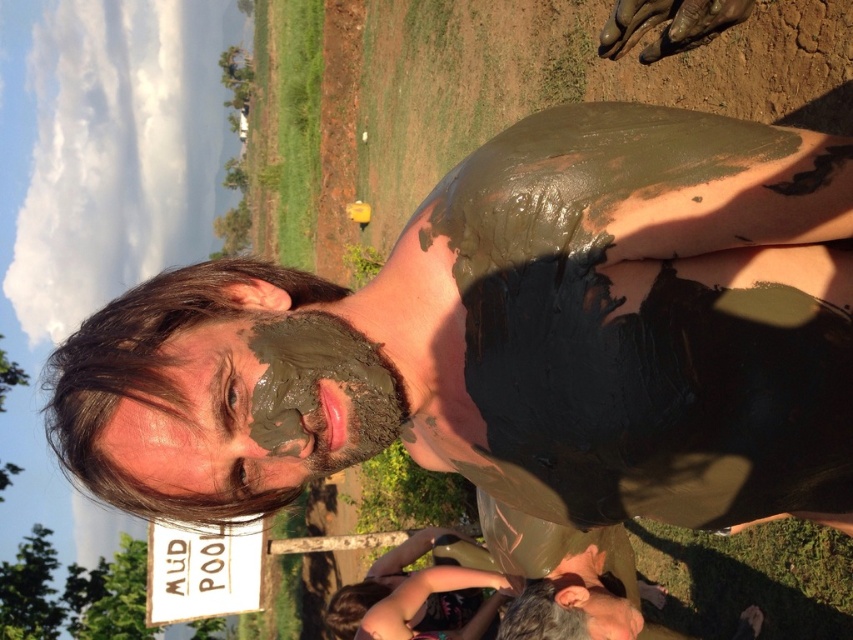
You are a photographer trying to capture the best angle of the person in the scene. Since you want to highlight the texture differences between the matte mud face at center and the muddy clay face at center, which one should you focus on to show a smoother surface?

The matte mud face at center is positioned over the muddy clay face at center, so focusing on the matte mud face at center will show a smoother surface.

What is the exact coordinate of the matte mud face at center in the image?

The matte mud face at center is located at point [514,339].

You are a photographer trying to capture a closeup of the person in the scene. You need to focus on the matte mud face at center and the muddy clay face at center. Given that your camera has a depth of field that can only sharply focus on objects within 4 inches of each other, will both faces be in focus?

The matte mud face at center is 4.59 inches away from the muddy clay face at center. Since the distance between them exceeds the camera lens depth of field limit of 4 inches, only one of the faces will be in focus at a time.